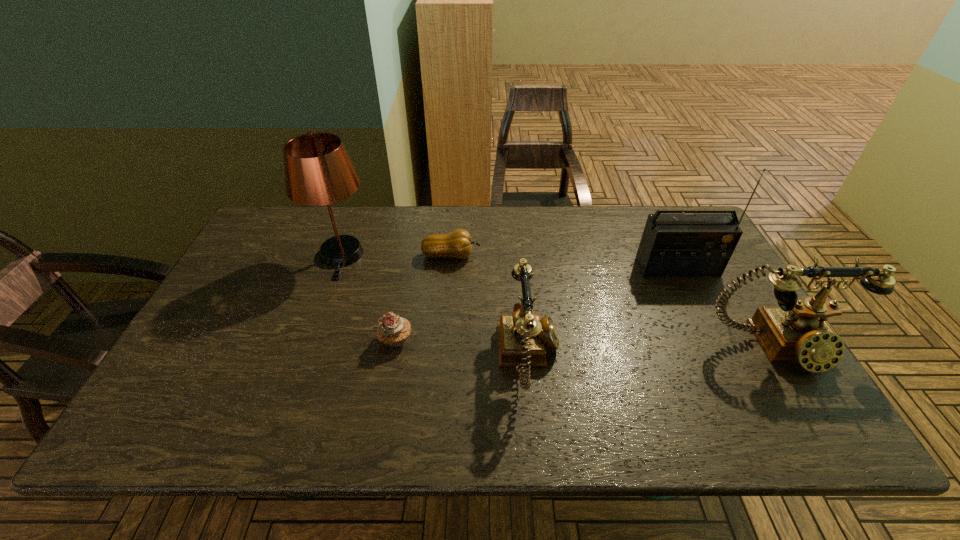
Identify the location of vacant space located 0.340m on the front-facing side of the leftmost object. The height and width of the screenshot is (540, 960). (297, 381).

This screenshot has width=960, height=540. In order to click on vacant space situated 0.190m on the stem side of the gourd in this screenshot , I will do `click(542, 255)`.

At what (x,y) coordinates should I click in order to perform the action: click on free space located on the front panel of the radio receiver. Please return your answer as a coordinate pair (x, y). The image size is (960, 540). Looking at the image, I should click on (689, 292).

Where is `vacant space located 0.050m on the left of the cupcake`? The image size is (960, 540). vacant space located 0.050m on the left of the cupcake is located at coordinates (359, 340).

In order to click on lampshade at the far edge in this screenshot , I will do `click(318, 171)`.

Identify the location of gourd present at the far edge. The image size is (960, 540). (458, 244).

Where is `telephone present at the right edge`? The image size is (960, 540). telephone present at the right edge is located at coordinates (796, 331).

Where is `radio receiver that is positioned at the right edge`? Image resolution: width=960 pixels, height=540 pixels. radio receiver that is positioned at the right edge is located at coordinates (673, 245).

Find the location of `object present at the near right corner`. object present at the near right corner is located at coordinates (796, 331).

In the image, there is a desktop. Where is `vacant space at the far edge`? The height and width of the screenshot is (540, 960). vacant space at the far edge is located at coordinates (556, 248).